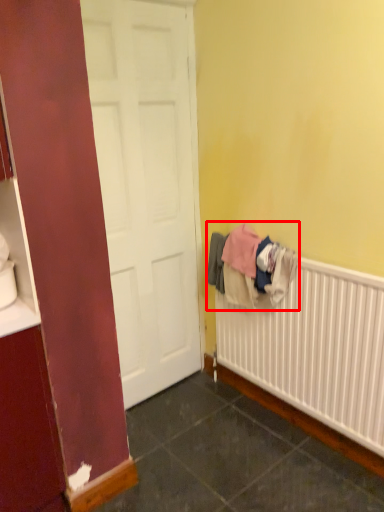
Question: In this image, where is clothing (annotated by the red box) located relative to radiator?

Choices:
 (A) right
 (B) left

Answer: (B)